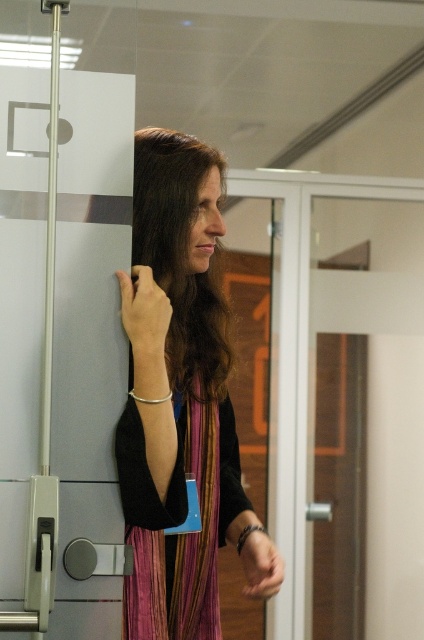
Question: Can you confirm if smooth skin hand at upper left is positioned to the left of matte black hand at lower center?

Choices:
 (A) no
 (B) yes

Answer: (B)

Question: Which object is positioned closest to the transparent glass door at center?

Choices:
 (A) multicolored striped dress at center
 (B) matte black hand at lower center
 (C) smooth skin hand at upper left

Answer: (A)

Question: Does smooth skin hand at upper left appear over matte black hand at lower center?

Choices:
 (A) no
 (B) yes

Answer: (B)

Question: Considering the relative positions of multicolored striped dress at center and smooth skin hand at upper left in the image provided, where is multicolored striped dress at center located with respect to smooth skin hand at upper left?

Choices:
 (A) right
 (B) left

Answer: (A)

Question: Which object is positioned closest to the matte black hand at lower center?

Choices:
 (A) transparent glass door at center
 (B) smooth skin hand at upper left

Answer: (B)

Question: Which point appears closest to the camera in this image?

Choices:
 (A) (248, 586)
 (B) (145, 435)

Answer: (B)